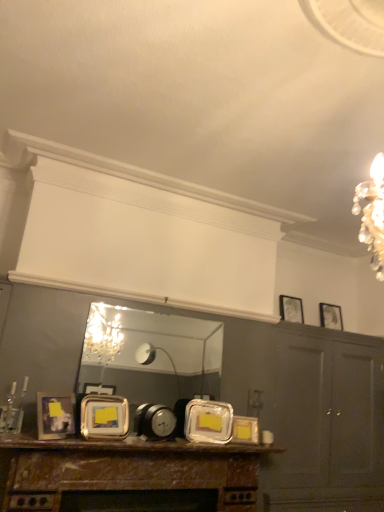
Where is `vacant region below metallic silver frame at center, acting as the 2th picture frame starting from the front (from a real-world perspective)`? Image resolution: width=384 pixels, height=512 pixels. vacant region below metallic silver frame at center, acting as the 2th picture frame starting from the front (from a real-world perspective) is located at coordinates (94, 439).